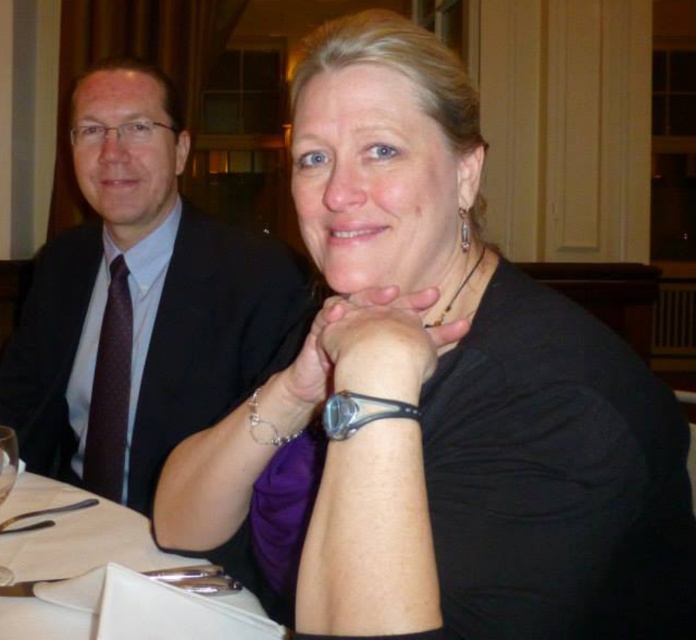
Can you confirm if matte black suit at left is positioned above black leather watch at center?

Yes.

Between matte black suit at left and black leather watch at center, which one is positioned higher?

Positioned higher is matte black suit at left.

Does point (116, 243) come behind point (416, 401)?

Yes, point (116, 243) is behind point (416, 401).

Where is `matte black suit at left`? This screenshot has height=640, width=696. matte black suit at left is located at coordinates (136, 301).

You are a GUI agent. You are given a task and a screenshot of the screen. Output one action in this format:
    pyautogui.click(x=<x>, y=<y>)
    Task: Click on the white paper napkin at lower center
    
    Given the screenshot: What is the action you would take?
    [72, 570]

Can you confirm if white paper napkin at lower center is positioned below black leather watch at center?

Yes.

The width and height of the screenshot is (696, 640). In order to click on white paper napkin at lower center in this screenshot , I will do `click(72, 570)`.

Can you confirm if black leather watch at center is positioned above brown dotted tie at left?

Yes, black leather watch at center is above brown dotted tie at left.

Find the location of a particular element. Image resolution: width=696 pixels, height=640 pixels. black leather watch at center is located at coordinates (367, 346).